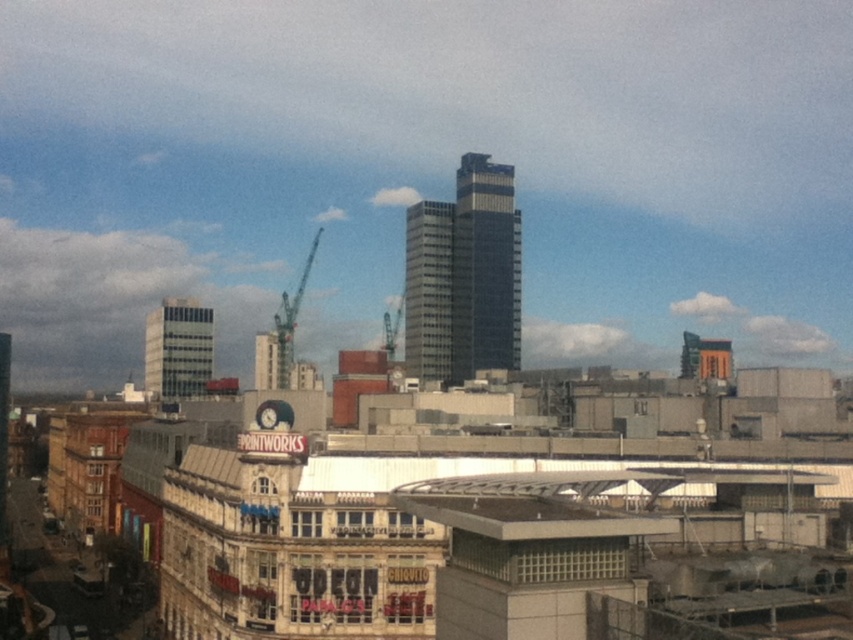
You are a drone operator who needs to fly a drone from the dark glass skyscraper at center to the metallic gray crane at center. Considering their heights, can the drone safely descend from the skyscraper to the crane without hitting any obstacles?

The dark glass skyscraper at center is taller than the metallic gray crane at center, so the drone can safely descend from the skyscraper to the crane without hitting any obstacles as the crane is shorter in height.

You are standing at the point marked as point (428, 291) in the cityscape. What is the nearest building to you?

The glassy silver skyscraper at center is located at point (428, 291), so the nearest building to you is the glassy silver skyscraper at center.